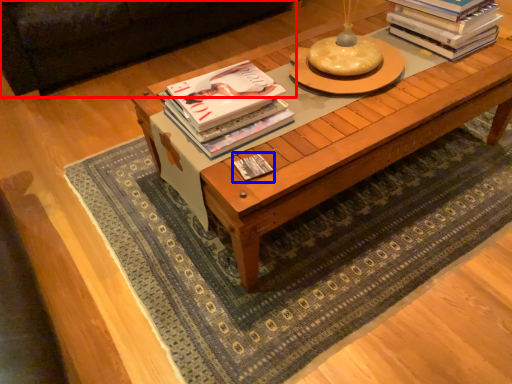
Question: Which point is further to the camera, couch (highlighted by a red box) or book (highlighted by a blue box)?

Choices:
 (A) couch
 (B) book

Answer: (A)